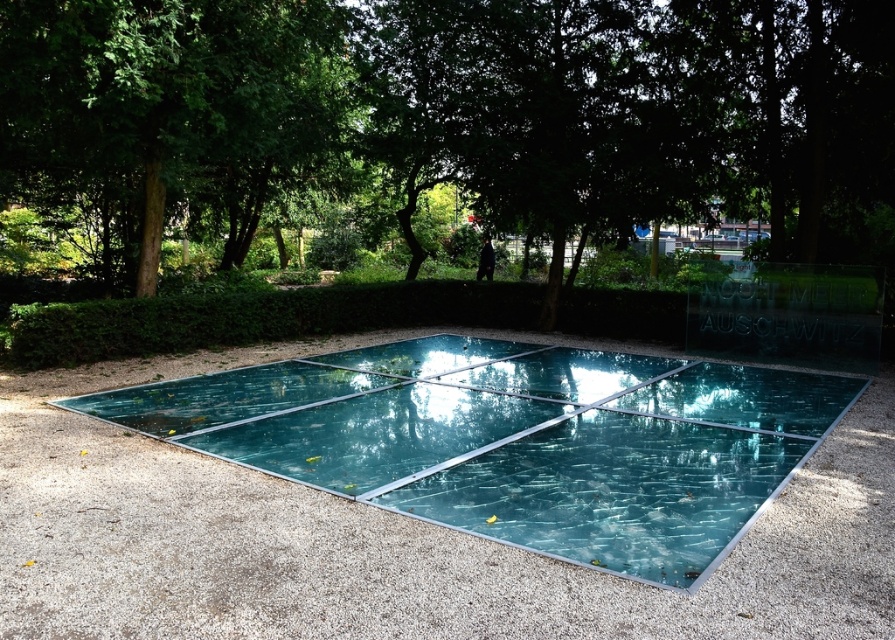
Question: Can you confirm if transparent glass pool at center is positioned to the left of green leafy tree at upper left?

Choices:
 (A) yes
 (B) no

Answer: (B)

Question: Is green leafy tree at center to the right of green leafy tree at upper left from the viewer's perspective?

Choices:
 (A) no
 (B) yes

Answer: (B)

Question: Is transparent glass pool at center closer to the viewer compared to green leafy tree at upper left?

Choices:
 (A) no
 (B) yes

Answer: (B)

Question: Estimate the real-world distances between objects in this image. Which object is closer to the green leafy tree at center?

Choices:
 (A) green leafy tree at upper left
 (B) transparent glass pool at center

Answer: (A)

Question: Considering the real-world distances, which object is farthest from the green leafy tree at upper left?

Choices:
 (A) transparent glass pool at center
 (B) green leafy tree at center

Answer: (A)

Question: Which point is closer to the camera?

Choices:
 (A) green leafy tree at center
 (B) transparent glass pool at center

Answer: (B)